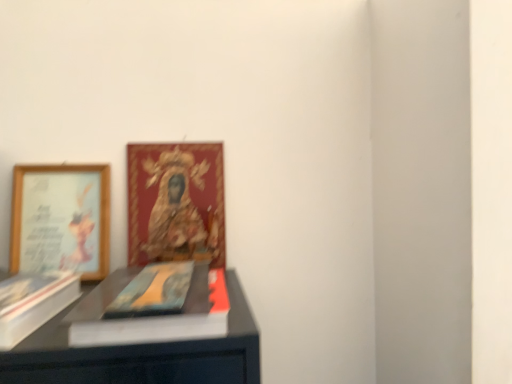
Where is `gold-framed picture at upper left, which appears as the first picture frame when viewed from the right`? gold-framed picture at upper left, which appears as the first picture frame when viewed from the right is located at coordinates (176, 203).

In order to face gold-framed picture at upper left, which appears as the first picture frame when viewed from the right, should I rotate leftwards or rightwards?

It's best to rotate left around 11.770 degrees.

Locate an element on the screen. The image size is (512, 384). matte blue book at center is located at coordinates point(152,316).

From a real-world perspective, is wooden framed picture at left, which appears as the second picture frame when viewed from the right, physically below gold-framed picture at upper left, which appears as the first picture frame when viewed from the right?

Yes.

From the image's perspective, which one is positioned higher, wooden framed picture at left, the first picture frame viewed from the left, or gold-framed picture at upper left, which appears as the first picture frame when viewed from the right?

gold-framed picture at upper left, which appears as the first picture frame when viewed from the right.

Choose the correct answer: Is wooden framed picture at left, the first picture frame viewed from the left, inside gold-framed picture at upper left, which appears as the first picture frame when viewed from the right, or outside it?

wooden framed picture at left, the first picture frame viewed from the left, cannot be found inside gold-framed picture at upper left, which appears as the first picture frame when viewed from the right.

Is white matte paperback book at left not near gold-framed picture at upper left, which appears as the first picture frame when viewed from the right?

No, white matte paperback book at left is not far away from gold-framed picture at upper left, which appears as the first picture frame when viewed from the right.

Which is closer, (75,298) or (213,257)?

Point (75,298).

Is white matte paperback book at left closer to camera compared to gold-framed picture at upper left, which is the 2th picture frame from left to right?

Yes, it is.

Is white matte paperback book at left aimed at gold-framed picture at upper left, which appears as the first picture frame when viewed from the right?

No.

Considering the positions of objects gold-framed picture at upper left, which is the 2th picture frame from left to right, and white matte paperback book at left in the image provided, who is more to the left, gold-framed picture at upper left, which is the 2th picture frame from left to right, or white matte paperback book at left?

white matte paperback book at left is more to the left.

In terms of height, does gold-framed picture at upper left, which is the 2th picture frame from left to right, look taller or shorter compared to white matte paperback book at left?

Clearly, gold-framed picture at upper left, which is the 2th picture frame from left to right, is taller compared to white matte paperback book at left.

How different are the orientations of gold-framed picture at upper left, which is the 2th picture frame from left to right, and white matte paperback book at left in degrees?

The angle between the facing direction of gold-framed picture at upper left, which is the 2th picture frame from left to right, and the facing direction of white matte paperback book at left is 4.06 degrees.

Which is behind, gold-framed picture at upper left, which appears as the first picture frame when viewed from the right, or white matte paperback book at left?

gold-framed picture at upper left, which appears as the first picture frame when viewed from the right, is further away from the camera.

Can you tell me how much matte blue book at center and white matte paperback book at left differ in facing direction?

The angular difference between matte blue book at center and white matte paperback book at left is 4.06 degrees.

Which is behind, matte blue book at center or white matte paperback book at left?

matte blue book at center is further away from the camera.

Is matte blue book at center turned away from white matte paperback book at left?

No, matte blue book at center is not facing the opposite direction of white matte paperback book at left.

In the scene shown: Who is shorter, wooden framed picture at left, which appears as the second picture frame when viewed from the right, or white matte paperback book at left?

white matte paperback book at left is shorter.

Is white matte paperback book at left located within wooden framed picture at left, which appears as the second picture frame when viewed from the right?

No, white matte paperback book at left is located outside of wooden framed picture at left, which appears as the second picture frame when viewed from the right.

Could you measure the distance between wooden framed picture at left, which appears as the second picture frame when viewed from the right, and white matte paperback book at left?

wooden framed picture at left, which appears as the second picture frame when viewed from the right, is 4.57 inches from white matte paperback book at left.

In the scene shown: Does wooden framed picture at left, the first picture frame viewed from the left, turn towards white matte paperback book at left?

Yes, wooden framed picture at left, the first picture frame viewed from the left, is oriented towards white matte paperback book at left.

Is gold-framed picture at upper left, which is the 2th picture frame from left to right, with wooden framed picture at left, which appears as the second picture frame when viewed from the right?

No, gold-framed picture at upper left, which is the 2th picture frame from left to right, is not making contact with wooden framed picture at left, which appears as the second picture frame when viewed from the right.

Considering the sizes of objects gold-framed picture at upper left, which is the 2th picture frame from left to right, and wooden framed picture at left, the first picture frame viewed from the left, in the image provided, who is wider, gold-framed picture at upper left, which is the 2th picture frame from left to right, or wooden framed picture at left, the first picture frame viewed from the left,?

wooden framed picture at left, the first picture frame viewed from the left, is wider.

Can you confirm if gold-framed picture at upper left, which appears as the first picture frame when viewed from the right, is smaller than wooden framed picture at left, which appears as the second picture frame when viewed from the right?

Correct, gold-framed picture at upper left, which appears as the first picture frame when viewed from the right, occupies less space than wooden framed picture at left, which appears as the second picture frame when viewed from the right.

Where is `picture frame lying below the gold-framed picture at upper left, which appears as the first picture frame when viewed from the right (from the image's perspective)`? The width and height of the screenshot is (512, 384). picture frame lying below the gold-framed picture at upper left, which appears as the first picture frame when viewed from the right (from the image's perspective) is located at coordinates (61, 219).

Does gold-framed picture at upper left, which appears as the first picture frame when viewed from the right, have a lesser width compared to matte blue book at center?

Correct, the width of gold-framed picture at upper left, which appears as the first picture frame when viewed from the right, is less than that of matte blue book at center.

Can you confirm if gold-framed picture at upper left, which appears as the first picture frame when viewed from the right, is shorter than matte blue book at center?

In fact, gold-framed picture at upper left, which appears as the first picture frame when viewed from the right, may be taller than matte blue book at center.

Which of these two, gold-framed picture at upper left, which is the 2th picture frame from left to right, or matte blue book at center, is smaller?

Smaller between the two is matte blue book at center.

From the picture: Which is correct: gold-framed picture at upper left, which appears as the first picture frame when viewed from the right, is inside matte blue book at center, or outside of it?

gold-framed picture at upper left, which appears as the first picture frame when viewed from the right, is located beyond the bounds of matte blue book at center.

Where is `picture frame above the wooden framed picture at left, which appears as the second picture frame when viewed from the right (from the image's perspective)`? picture frame above the wooden framed picture at left, which appears as the second picture frame when viewed from the right (from the image's perspective) is located at coordinates (176, 203).

I want to click on picture frame that is the 2nd object above the white matte paperback book at left (from a real-world perspective), so click(x=176, y=203).

Which object lies further to the anchor point gold-framed picture at upper left, which appears as the first picture frame when viewed from the right, white matte paperback book at left or matte blue book at center?

The object further to gold-framed picture at upper left, which appears as the first picture frame when viewed from the right, is white matte paperback book at left.

When comparing their distances from wooden framed picture at left, the first picture frame viewed from the left, does gold-framed picture at upper left, which appears as the first picture frame when viewed from the right, or matte blue book at center seem further?

The object further to wooden framed picture at left, the first picture frame viewed from the left, is matte blue book at center.

Considering their positions, is white matte paperback book at left positioned further to matte blue book at center than gold-framed picture at upper left, which is the 2th picture frame from left to right?

Among the two, gold-framed picture at upper left, which is the 2th picture frame from left to right, is located further to matte blue book at center.

Based on the photo, from the image, which object appears to be farther from white matte paperback book at left, wooden framed picture at left, the first picture frame viewed from the left, or matte blue book at center?

Based on the image, wooden framed picture at left, the first picture frame viewed from the left, appears to be further to white matte paperback book at left.

Looking at this image, when comparing their distances from gold-framed picture at upper left, which is the 2th picture frame from left to right, does matte blue book at center or wooden framed picture at left, which appears as the second picture frame when viewed from the right, seem further?

Among the two, matte blue book at center is located further to gold-framed picture at upper left, which is the 2th picture frame from left to right.

Based on their spatial positions, is gold-framed picture at upper left, which is the 2th picture frame from left to right, or white matte paperback book at left further from wooden framed picture at left, the first picture frame viewed from the left?

gold-framed picture at upper left, which is the 2th picture frame from left to right, is further to wooden framed picture at left, the first picture frame viewed from the left.

From the image, which object appears to be farther from wooden framed picture at left, the first picture frame viewed from the left, matte blue book at center or white matte paperback book at left?

The object further to wooden framed picture at left, the first picture frame viewed from the left, is matte blue book at center.

Looking at the image, which one is located further to gold-framed picture at upper left, which is the 2th picture frame from left to right, matte blue book at center or white matte paperback book at left?

white matte paperback book at left lies further to gold-framed picture at upper left, which is the 2th picture frame from left to right, than the other object.

You are a GUI agent. You are given a task and a screenshot of the screen. Output one action in this format:
    pyautogui.click(x=<x>, y=<y>)
    Task: Click on the picture frame between white matte paperback book at left and gold-framed picture at upper left, which is the 2th picture frame from left to right, from front to back
    This screenshot has height=384, width=512.
    Given the screenshot: What is the action you would take?
    pyautogui.click(x=61, y=219)

The height and width of the screenshot is (384, 512). Identify the location of book cover between white matte paperback book at left and gold-framed picture at upper left, which appears as the first picture frame when viewed from the right, along the z-axis. (152, 316).

The image size is (512, 384). In order to click on picture frame located between matte blue book at center and gold-framed picture at upper left, which is the 2th picture frame from left to right, in the depth direction in this screenshot , I will do click(x=61, y=219).

At what (x,y) coordinates should I click in order to perform the action: click on book cover between white matte paperback book at left and wooden framed picture at left, the first picture frame viewed from the left, along the z-axis. Please return your answer as a coordinate pair (x, y). Looking at the image, I should click on (152, 316).